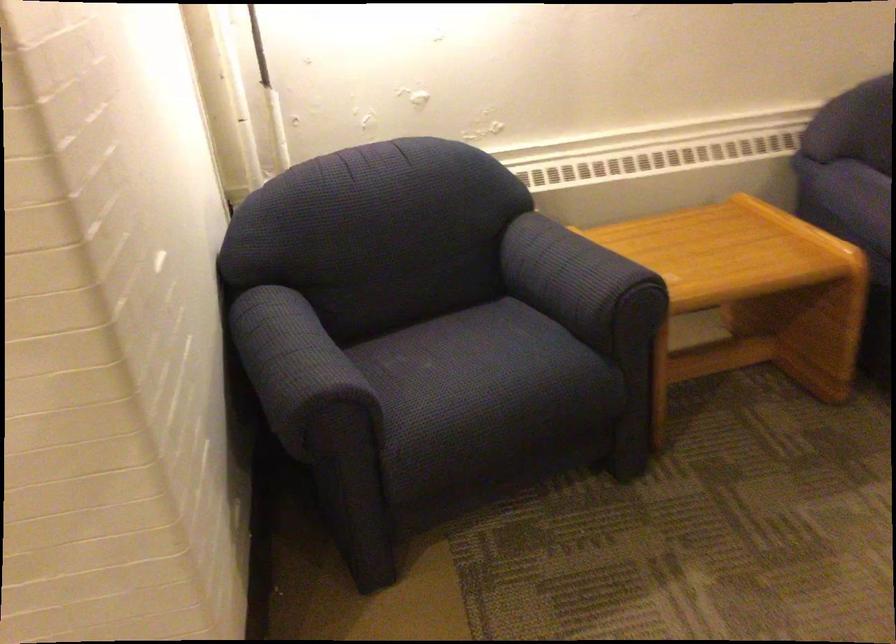
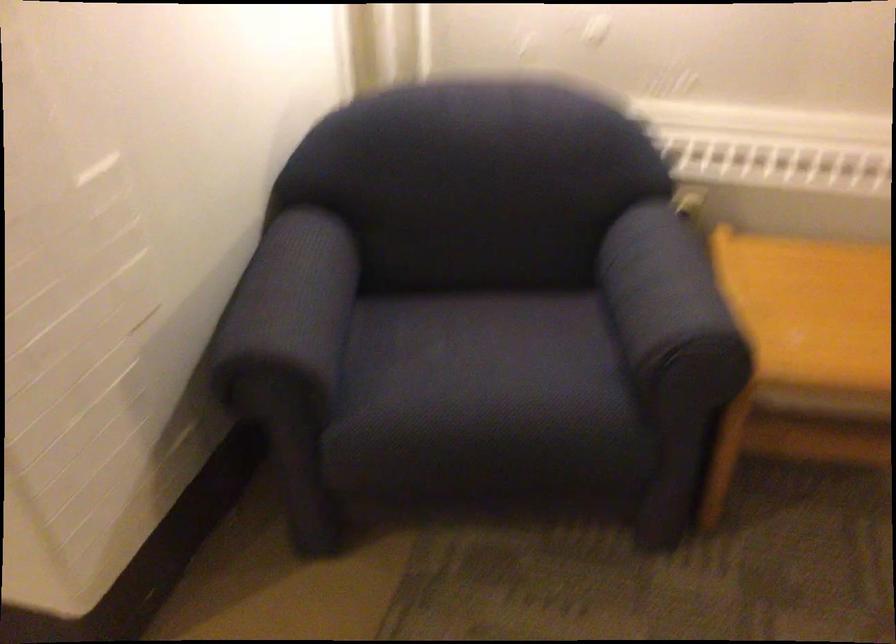
Find the pixel in the second image that matches the point at 485,361 in the first image.

(485, 366)